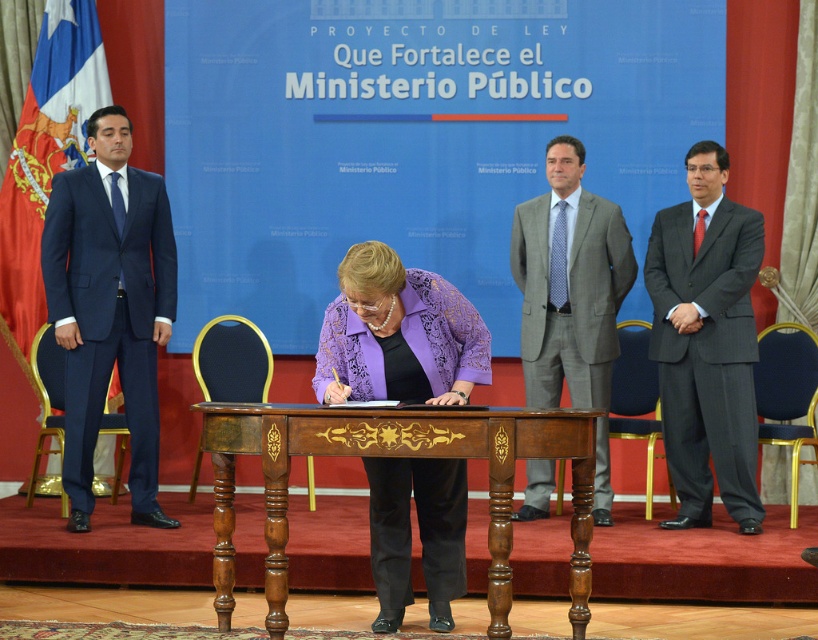
Question: Which point is farther to the camera?

Choices:
 (A) (375, 257)
 (B) (409, 436)
 (C) (729, 470)

Answer: (C)

Question: Does navy blue suit at left appear on the right side of gray textured suit at center?

Choices:
 (A) yes
 (B) no

Answer: (B)

Question: Is the position of purple textured blouse at center more distant than that of wooden at center?

Choices:
 (A) no
 (B) yes

Answer: (B)

Question: Which of the following is the farthest from the observer?

Choices:
 (A) (160, 272)
 (B) (569, 177)
 (C) (672, 460)
 (D) (277, 580)

Answer: (B)

Question: Which point is farther from the camera taking this photo?

Choices:
 (A) (488, 422)
 (B) (736, 378)

Answer: (B)

Question: Can you confirm if navy blue suit at left is positioned to the left of dark gray suit at right?

Choices:
 (A) yes
 (B) no

Answer: (A)